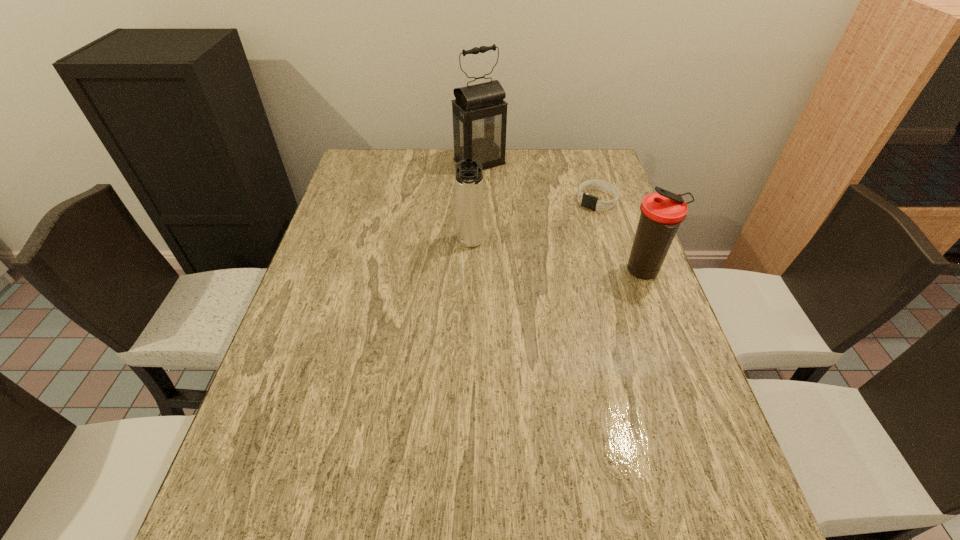
At what (x,y) coordinates should I click in order to perform the action: click on free space on the desktop that is between the left thermos bottle and the right thermos bottle and is positioned on the outer surface of the third nearest object. Please return your answer as a coordinate pair (x, y). This screenshot has height=540, width=960. Looking at the image, I should click on (540, 255).

I want to click on free space on the desktop that is between the left thermos bottle and the right thermos bottle and is positioned on the front-facing side of the lantern, so pos(579,262).